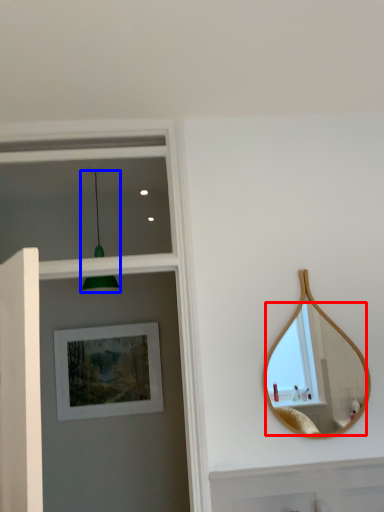
Question: Which object appears closest to the camera in this image, mirror (highlighted by a red box) or light fixture (highlighted by a blue box)?

Choices:
 (A) mirror
 (B) light fixture

Answer: (A)